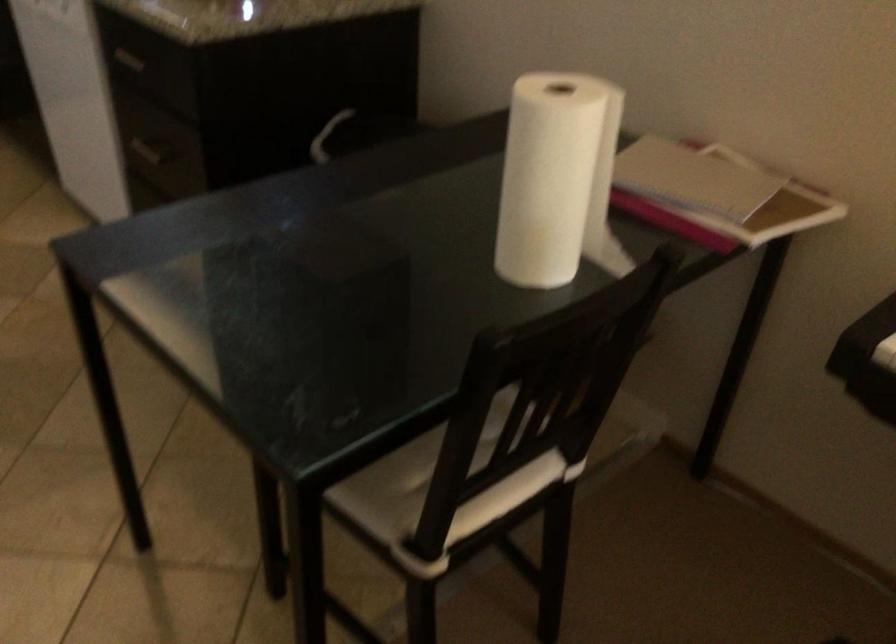
First-person continuous shooting, in which direction is the camera rotating?

The camera rotated toward right-down.